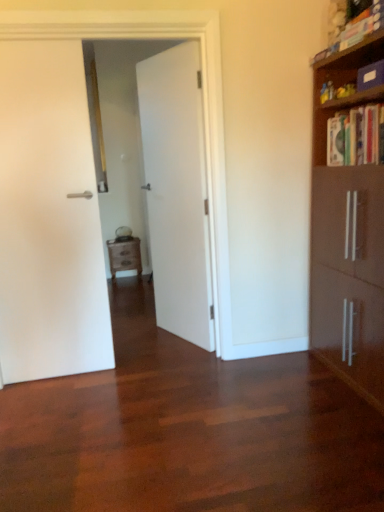
Question: Is wooden nightstand at center taller than white matte door at center, placed as the 1th door when sorted from right to left?

Choices:
 (A) no
 (B) yes

Answer: (A)

Question: Is wooden nightstand at center wider than white matte door at center, placed as the 1th door when sorted from right to left?

Choices:
 (A) yes
 (B) no

Answer: (A)

Question: Would you say wooden nightstand at center is a long distance from white matte door at center, placed as the 1th door when sorted from right to left?

Choices:
 (A) yes
 (B) no

Answer: (A)

Question: Considering the relative sizes of wooden nightstand at center and white matte door at center, placed as the 1th door when sorted from right to left, in the image provided, is wooden nightstand at center smaller than white matte door at center, placed as the 1th door when sorted from right to left,?

Choices:
 (A) yes
 (B) no

Answer: (A)

Question: From the image's perspective, would you say wooden nightstand at center is positioned over white matte door at center, placed as the 1th door when sorted from right to left?

Choices:
 (A) no
 (B) yes

Answer: (A)

Question: Would you say white matte door at center, placed as the 1th door when sorted from right to left, is inside or outside hardcover book at upper right, the 1th book viewed from the top?

Choices:
 (A) inside
 (B) outside

Answer: (B)

Question: In the image, is white matte door at center, placed as the 1th door when sorted from right to left, on the left side or the right side of hardcover book at upper right, the 1th book viewed from the top?

Choices:
 (A) left
 (B) right

Answer: (A)

Question: From the image's perspective, is white matte door at center, placed as the 1th door when sorted from right to left, above or below hardcover book at upper right, the 1th book viewed from the top?

Choices:
 (A) below
 (B) above

Answer: (A)

Question: Considering the positions of white matte door at center, placed as the 1th door when sorted from right to left, and hardcover book at upper right, which is the second book from bottom to top, in the image, is white matte door at center, placed as the 1th door when sorted from right to left, bigger or smaller than hardcover book at upper right, which is the second book from bottom to top,?

Choices:
 (A) small
 (B) big

Answer: (B)

Question: Is hardcover book at upper right, the 1th book viewed from the top, inside the boundaries of wooden nightstand at center, or outside?

Choices:
 (A) inside
 (B) outside

Answer: (B)

Question: Considering the relative positions of hardcover book at upper right, the 1th book viewed from the top, and wooden nightstand at center in the image provided, is hardcover book at upper right, the 1th book viewed from the top, to the left or to the right of wooden nightstand at center?

Choices:
 (A) left
 (B) right

Answer: (B)

Question: In terms of height, does hardcover book at upper right, which is the second book from bottom to top, look taller or shorter compared to wooden nightstand at center?

Choices:
 (A) short
 (B) tall

Answer: (A)

Question: Looking at the image, does hardcover book at upper right, which is the second book from bottom to top, seem bigger or smaller compared to wooden nightstand at center?

Choices:
 (A) small
 (B) big

Answer: (A)

Question: Does point (377, 10) appear closer or farther from the camera than point (180, 61)?

Choices:
 (A) closer
 (B) farther

Answer: (A)

Question: Relative to white matte door at center, the 2th door positioned from the left, is hardcover book at upper right, which is the second book from bottom to top, in front or behind?

Choices:
 (A) behind
 (B) front

Answer: (B)